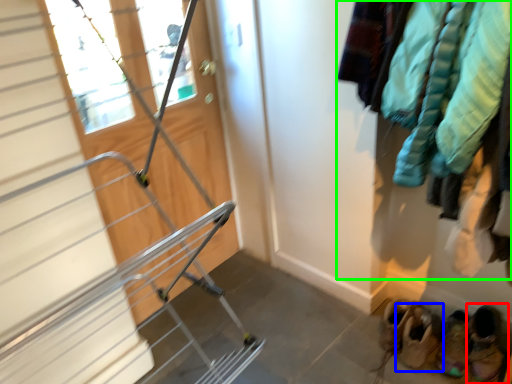
Question: Estimate the real-world distances between objects in this image. Which object is farther from footwear (highlighted by a red box), footwear (highlighted by a blue box) or clothing (highlighted by a green box)?

Choices:
 (A) footwear
 (B) clothing

Answer: (B)